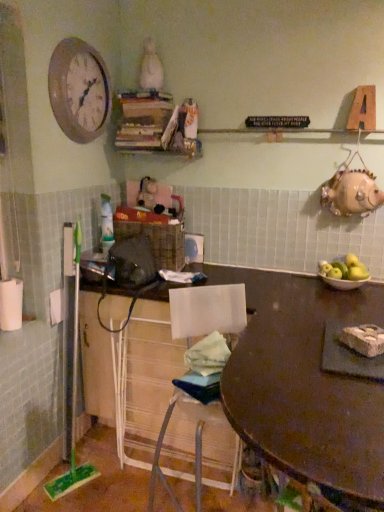
Describe the element at coordinates (304, 383) in the screenshot. The height and width of the screenshot is (512, 384). I see `wooden table at center` at that location.

Locate an element on the screen. matte white bowl at right is located at coordinates (343, 282).

Image resolution: width=384 pixels, height=512 pixels. What do you see at coordinates (344, 269) in the screenshot?
I see `green matte apples at right` at bounding box center [344, 269].

Find the location of `white matte toilet paper at left`. white matte toilet paper at left is located at coordinates (11, 304).

This screenshot has height=512, width=384. Identify the location of wooden table at center. (304, 383).

Based on the photo, does white wire mesh cabinet at lower center touch white crumbly food at table?

white wire mesh cabinet at lower center and white crumbly food at table are clearly separated.

In terms of width, does white wire mesh cabinet at lower center look wider or thinner when compared to white crumbly food at table?

In the image, white wire mesh cabinet at lower center appears to be wider than white crumbly food at table.

In the scene shown: Which object is positioned more to the right, white wire mesh cabinet at lower center or white crumbly food at table?

white crumbly food at table.

How different are the orientations of white wire mesh cabinet at lower center and white crumbly food at table in degrees?

There is a 41.9-degree angle between the facing directions of white wire mesh cabinet at lower center and white crumbly food at table.

From the image's perspective, is wooden table at center beneath matte white bowl at right?

Indeed, from the image's perspective, wooden table at center is shown beneath matte white bowl at right.

In the image, is wooden table at center on the left side or the right side of matte white bowl at right?

wooden table at center is to the left of matte white bowl at right.

I want to click on table in front of the matte white bowl at right, so click(304, 383).

Is wooden table at center positioned in front of matte white bowl at right?

That is True.

Considering the relative positions of white wire mesh cabinet at lower center and wooden table at center in the image provided, is white wire mesh cabinet at lower center behind wooden table at center?

Yes, white wire mesh cabinet at lower center is further from the camera.

Where is `cabinetry below the wooden table at center (from the image's perspective)`? cabinetry below the wooden table at center (from the image's perspective) is located at coordinates (150, 370).

Is white wire mesh cabinet at lower center positioned far away from wooden table at center?

white wire mesh cabinet at lower center is actually quite close to wooden table at center.

Does green matte apples at right turn towards wooden table at center?

No, green matte apples at right is not oriented towards wooden table at center.

From the image's perspective, which is below, green matte apples at right or wooden table at center?

From the image's view, wooden table at center is below.

Does point (341, 264) lie in front of point (363, 292)?

No, it is behind (363, 292).

Would you say green matte apples at right is to the left or to the right of wooden table at center in the picture?

green matte apples at right is to the right of wooden table at center.

From a real-world perspective, is matte white bowl at right located higher than wooden clock at upper left?

No, from a real-world perspective, matte white bowl at right is not above wooden clock at upper left.

Is matte white bowl at right not close to wooden clock at upper left?

Indeed, matte white bowl at right is not near wooden clock at upper left.

Is matte white bowl at right looking in the opposite direction of wooden clock at upper left?

No, matte white bowl at right is not facing the opposite direction of wooden clock at upper left.

Based on the photo, what's the angular difference between matte white bowl at right and wooden clock at upper left's facing directions?

89.6 degrees.

Between wooden clock at upper left and white wire mesh cabinet at lower center, which one is positioned behind?

wooden clock at upper left is more distant.

At what (x,y) coordinates should I click in order to perform the action: click on clock lying behind the white wire mesh cabinet at lower center. Please return your answer as a coordinate pair (x, y). Looking at the image, I should click on (79, 90).

Is wooden clock at upper left not inside white wire mesh cabinet at lower center?

Yes, wooden clock at upper left is outside of white wire mesh cabinet at lower center.

Is wooden clock at upper left wider than white wire mesh cabinet at lower center?

No.

Is matte white bowl at right positioned with its back to wooden table at center?

No, matte white bowl at right's orientation is not away from wooden table at center.

Is matte white bowl at right spatially inside wooden table at center, or outside of it?

The correct answer is: outside.

Where is `bowl above the wooden table at center (from the image's perspective)`? This screenshot has height=512, width=384. bowl above the wooden table at center (from the image's perspective) is located at coordinates (343, 282).

Is matte white bowl at right in contact with wooden table at center?

No, matte white bowl at right is not beside wooden table at center.

In order to click on cabinetry below the white crumbly food at table (from a real-world perspective) in this screenshot , I will do `click(150, 370)`.

Where is `table on the left of matte white bowl at right`? table on the left of matte white bowl at right is located at coordinates (304, 383).

When comparing their distances from white matte toilet paper at left, does matte white bowl at right or green matte apples at right seem closer?

Among the two, matte white bowl at right is located nearer to white matte toilet paper at left.

Considering their positions, is wooden table at center positioned further to white matte toilet paper at left than matte white bowl at right?

Among the two, matte white bowl at right is located further to white matte toilet paper at left.

Based on their spatial positions, is white matte toilet paper at left or wooden clock at upper left further from wooden table at center?

The object further to wooden table at center is wooden clock at upper left.

Looking at the image, which one is located further to green matte apples at right, matte white bowl at right or wooden table at center?

wooden table at center.

When comparing their distances from green matte apples at right, does white matte toilet paper at left or matte white bowl at right seem closer?

Among the two, matte white bowl at right is located nearer to green matte apples at right.

When comparing their distances from white matte toilet paper at left, does white wire mesh cabinet at lower center or matte white bowl at right seem closer?

The object closer to white matte toilet paper at left is white wire mesh cabinet at lower center.

Estimate the real-world distances between objects in this image. Which object is further from white matte toilet paper at left, wooden clock at upper left or green matte apples at right?

green matte apples at right lies further to white matte toilet paper at left than the other object.

Based on their spatial positions, is wooden clock at upper left or white matte toilet paper at left further from matte white bowl at right?

white matte toilet paper at left is positioned further to the anchor matte white bowl at right.

Image resolution: width=384 pixels, height=512 pixels. I want to click on table located between white wire mesh cabinet at lower center and green matte apples at right in the left-right direction, so click(x=304, y=383).

Identify the location of bowl between wooden clock at upper left and wooden table at center vertically. The width and height of the screenshot is (384, 512). (343, 282).

Find the location of a particular element. table between white wire mesh cabinet at lower center and white crumbly food at table is located at coordinates (304, 383).

Find the location of a particular element. The image size is (384, 512). apple between wooden clock at upper left and wooden table at center vertically is located at coordinates (344, 269).